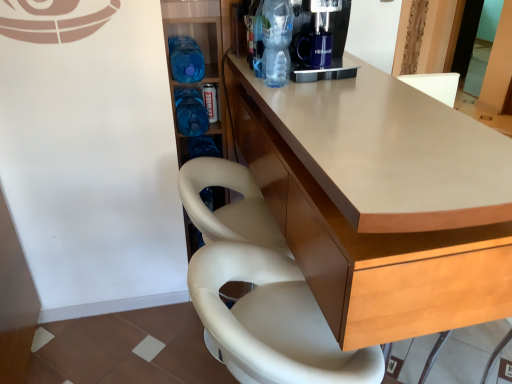
Question: Is blue plastic bottle at center-left, acting as the first bottle starting from the back, placed right next to white leather chair at lower center?

Choices:
 (A) yes
 (B) no

Answer: (B)

Question: Can you confirm if blue plastic bottle at center-left, placed as the third bottle when sorted from front to back, is wider than white leather chair at lower center?

Choices:
 (A) yes
 (B) no

Answer: (B)

Question: Can you confirm if blue plastic bottle at center-left, placed as the third bottle when sorted from front to back, is bigger than white leather chair at lower center?

Choices:
 (A) no
 (B) yes

Answer: (A)

Question: Is blue plastic bottle at center-left, acting as the first bottle starting from the back, closer to the viewer compared to white leather chair at lower center?

Choices:
 (A) no
 (B) yes

Answer: (A)

Question: From the image's perspective, is blue plastic bottle at center-left, placed as the third bottle when sorted from front to back, over white leather chair at lower center?

Choices:
 (A) no
 (B) yes

Answer: (B)

Question: Which is correct: matte wood counter at center is inside blue plastic bottle at center-left, which appears as the first bottle when viewed from the left, or outside of it?

Choices:
 (A) inside
 (B) outside

Answer: (B)

Question: Based on their positions, is matte wood counter at center located to the left or right of blue plastic bottle at center-left, the second bottle positioned from the back?

Choices:
 (A) right
 (B) left

Answer: (A)

Question: Based on their sizes in the image, would you say matte wood counter at center is bigger or smaller than blue plastic bottle at center-left, the 3th bottle positioned from the right?

Choices:
 (A) small
 (B) big

Answer: (B)

Question: Considering the positions of point (413, 264) and point (180, 77), is point (413, 264) closer or farther from the camera than point (180, 77)?

Choices:
 (A) closer
 (B) farther

Answer: (A)

Question: Is white leather chair at lower center to the left or to the right of blue plastic bottle at center-left, acting as the first bottle starting from the back, in the image?

Choices:
 (A) left
 (B) right

Answer: (B)

Question: Relative to blue plastic bottle at center-left, arranged as the 2th bottle when viewed from the right, is white leather chair at lower center in front or behind?

Choices:
 (A) behind
 (B) front

Answer: (B)

Question: Would you say white leather chair at lower center is inside or outside blue plastic bottle at center-left, arranged as the 2th bottle when viewed from the right?

Choices:
 (A) outside
 (B) inside

Answer: (A)

Question: Is white leather chair at lower center wider or thinner than blue plastic bottle at center-left, placed as the third bottle when sorted from front to back?

Choices:
 (A) wide
 (B) thin

Answer: (A)

Question: Does point (174, 97) appear closer or farther from the camera than point (242, 147)?

Choices:
 (A) farther
 (B) closer

Answer: (B)

Question: Is blue plastic bottle at center-left, acting as the first bottle starting from the back, wider or thinner than matte wood counter at center?

Choices:
 (A) thin
 (B) wide

Answer: (A)